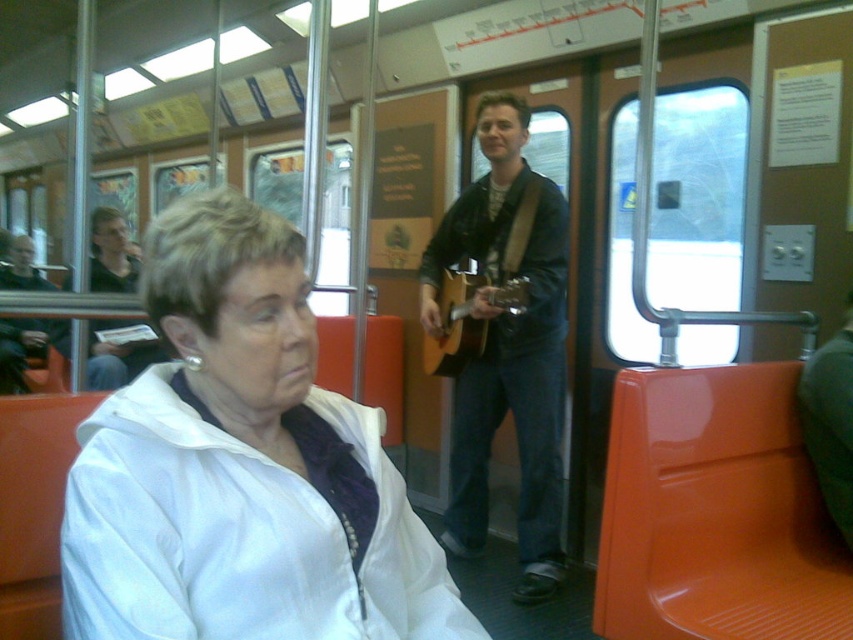
Can you confirm if white matte jacket at center is positioned to the right of acoustic wood guitar at center?

Incorrect, white matte jacket at center is not on the right side of acoustic wood guitar at center.

Which is below, white matte jacket at center or acoustic wood guitar at center?

white matte jacket at center

Between point (242, 438) and point (474, 284), which one is positioned in front?

Point (242, 438) is in front.

You are a GUI agent. You are given a task and a screenshot of the screen. Output one action in this format:
    pyautogui.click(x=<x>, y=<y>)
    Task: Click on the white matte jacket at center
    The height and width of the screenshot is (640, 853).
    Given the screenshot: What is the action you would take?
    pyautogui.click(x=241, y=467)

Is white matte jacket at center taller than matte brown guitar at center?

No.

Does white matte jacket at center have a smaller size compared to matte brown guitar at center?

Correct, white matte jacket at center occupies less space than matte brown guitar at center.

Is point (138, 419) positioned behind point (527, 472)?

No.

Image resolution: width=853 pixels, height=640 pixels. I want to click on white matte jacket at center, so click(241, 467).

Based on the photo, does matte brown guitar at center have a larger size compared to acoustic wood guitar at center?

Yes, matte brown guitar at center is bigger than acoustic wood guitar at center.

Can you confirm if matte brown guitar at center is positioned to the left of acoustic wood guitar at center?

In fact, matte brown guitar at center is to the right of acoustic wood guitar at center.

In the scene shown: Measure the distance between point [489,252] and camera.

9.33 feet

Image resolution: width=853 pixels, height=640 pixels. In order to click on matte brown guitar at center in this screenshot , I will do `click(508, 344)`.